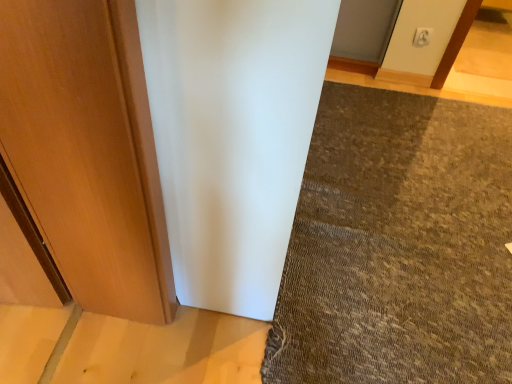
Question: Would you say white plastic electric outlet at upper center contains brown textured mat at lower right?

Choices:
 (A) no
 (B) yes

Answer: (A)

Question: Is the depth of white plastic electric outlet at upper center greater than that of brown textured mat at lower right?

Choices:
 (A) no
 (B) yes

Answer: (B)

Question: Can you confirm if white plastic electric outlet at upper center is shorter than brown textured mat at lower right?

Choices:
 (A) yes
 (B) no

Answer: (B)

Question: From a real-world perspective, is white plastic electric outlet at upper center under brown textured mat at lower right?

Choices:
 (A) yes
 (B) no

Answer: (B)

Question: Considering the relative positions of white plastic electric outlet at upper center and brown textured mat at lower right in the image provided, is white plastic electric outlet at upper center to the right of brown textured mat at lower right from the viewer's perspective?

Choices:
 (A) yes
 (B) no

Answer: (A)

Question: Is white plastic electric outlet at upper center thinner than brown textured mat at lower right?

Choices:
 (A) yes
 (B) no

Answer: (A)

Question: Can you confirm if brown textured mat at lower right is shorter than white plastic electric outlet at upper center?

Choices:
 (A) no
 (B) yes

Answer: (B)

Question: Could you tell me if brown textured mat at lower right is facing white plastic electric outlet at upper center?

Choices:
 (A) yes
 (B) no

Answer: (B)

Question: Considering the relative sizes of brown textured mat at lower right and white plastic electric outlet at upper center in the image provided, is brown textured mat at lower right taller than white plastic electric outlet at upper center?

Choices:
 (A) no
 (B) yes

Answer: (A)

Question: Is brown textured mat at lower right outside of white plastic electric outlet at upper center?

Choices:
 (A) no
 (B) yes

Answer: (B)

Question: Is brown textured mat at lower right oriented away from white plastic electric outlet at upper center?

Choices:
 (A) no
 (B) yes

Answer: (A)

Question: From a real-world perspective, is brown textured mat at lower right physically above white plastic electric outlet at upper center?

Choices:
 (A) no
 (B) yes

Answer: (A)

Question: In terms of height, does brown textured mat at lower right look taller or shorter compared to white plastic electric outlet at upper center?

Choices:
 (A) tall
 (B) short

Answer: (B)